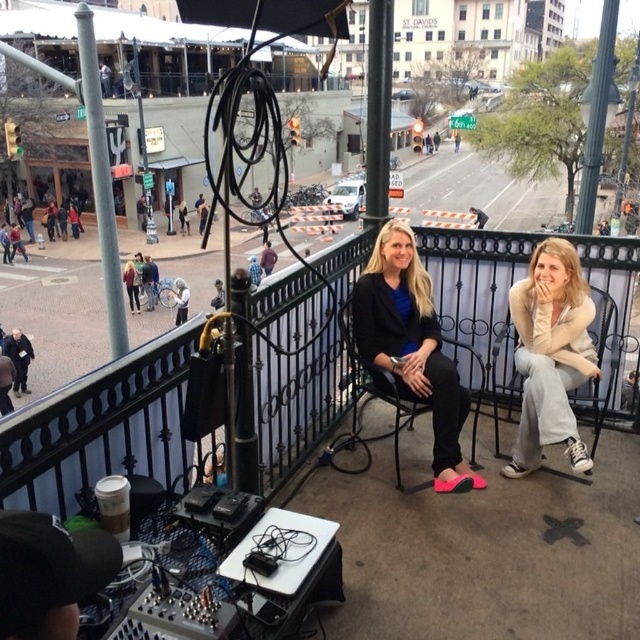
Question: Can you confirm if black wrought iron railing at center is positioned below matte black blazer at center?

Choices:
 (A) yes
 (B) no

Answer: (A)

Question: Estimate the real-world distances between objects in this image. Which object is closer to the black wrought iron railing at center?

Choices:
 (A) white fabric umbrella at upper center
 (B) light beige sweater at center
 (C) matte black blazer at center

Answer: (C)

Question: Does matte black blazer at center lie behind light beige sweater at center?

Choices:
 (A) yes
 (B) no

Answer: (A)

Question: Can you confirm if black wrought iron railing at center is smaller than matte black blazer at center?

Choices:
 (A) no
 (B) yes

Answer: (A)

Question: Which point is closer to the camera taking this photo?

Choices:
 (A) (401, 388)
 (B) (536, 436)

Answer: (A)

Question: Which object is the farthest from the white fabric umbrella at upper center?

Choices:
 (A) black wrought iron railing at center
 (B) light beige sweater at center
 (C) matte black blazer at center

Answer: (B)